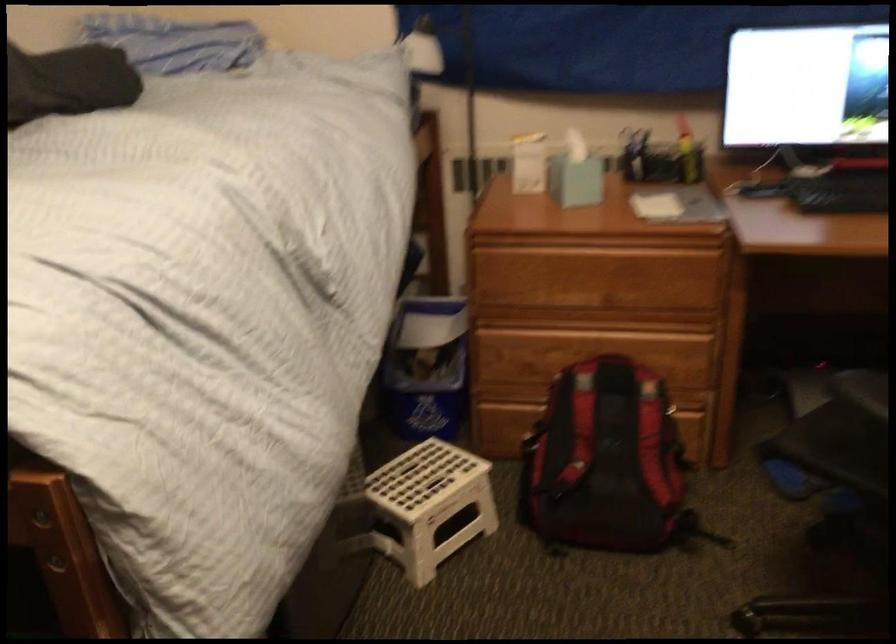
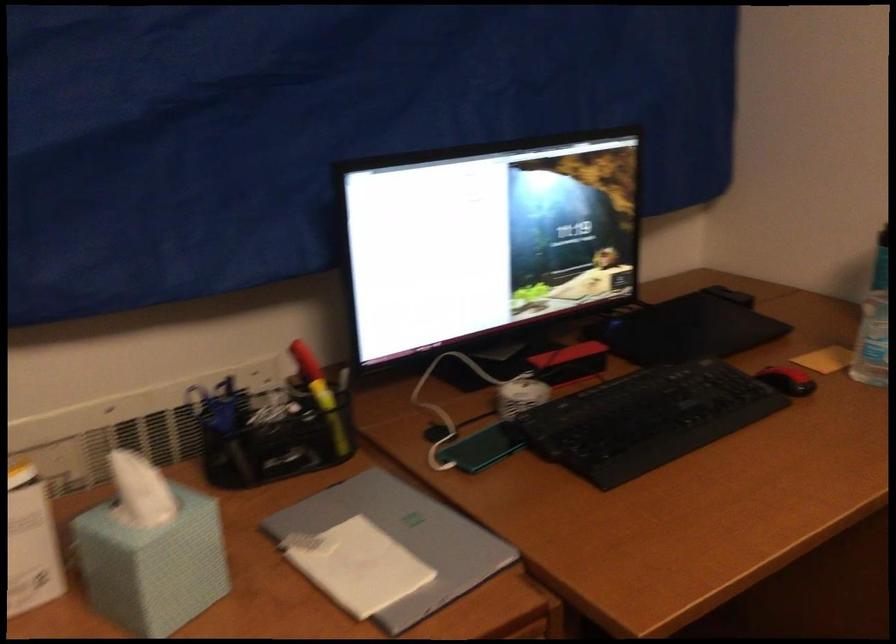
The point at (684, 205) is marked in the first image. Where is the corresponding point in the second image?

(403, 538)